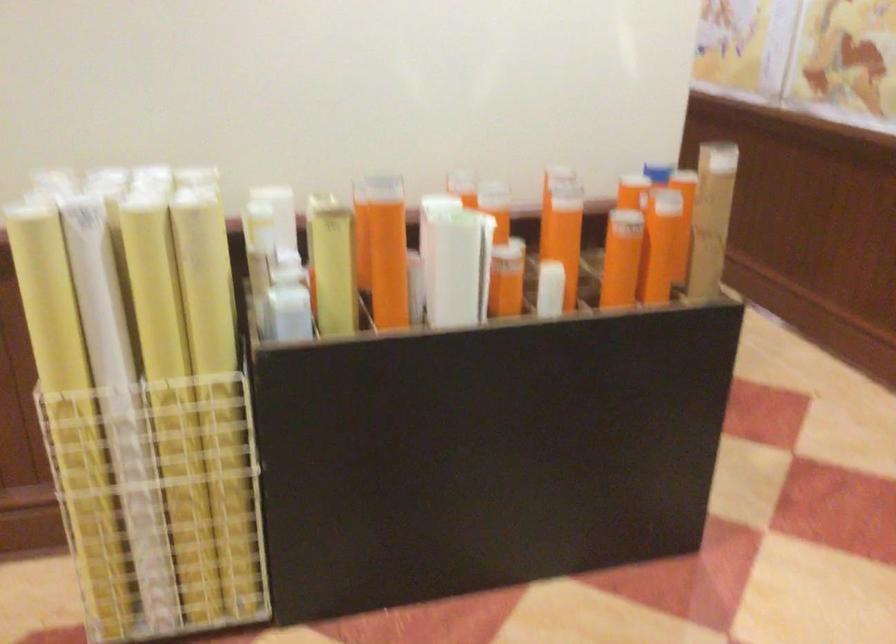
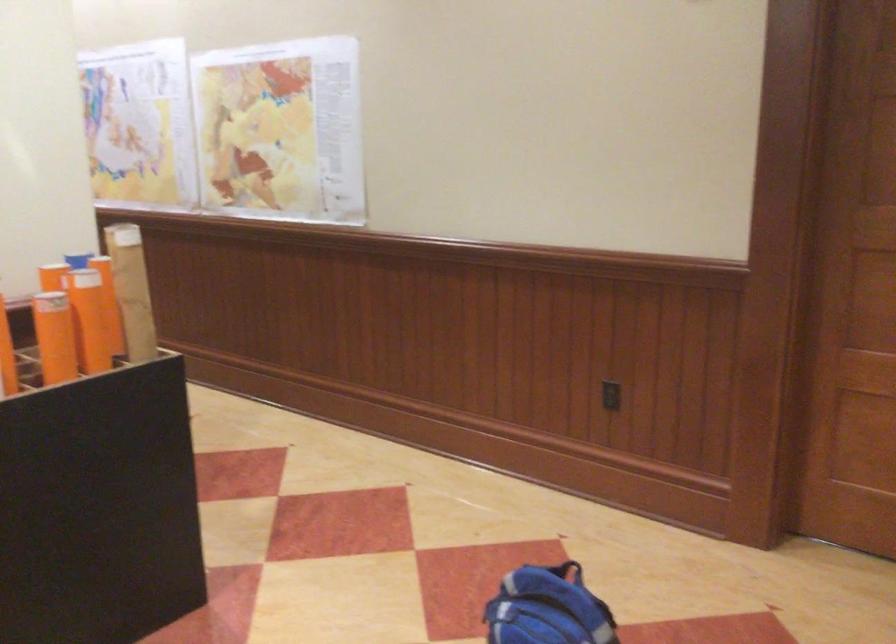
Question: How did the camera likely rotate?

Choices:
 (A) Left
 (B) Right
 (C) Up
 (D) Down

Answer: (B)